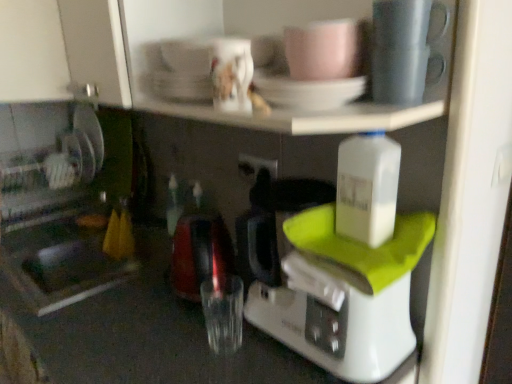
Question: Considering the positions of black plastic electric outlet at center and white plastic coffee maker at center in the image, is black plastic electric outlet at center taller or shorter than white plastic coffee maker at center?

Choices:
 (A) tall
 (B) short

Answer: (B)

Question: Is black plastic electric outlet at center in front of or behind white plastic coffee maker at center in the image?

Choices:
 (A) front
 (B) behind

Answer: (B)

Question: Estimate the real-world distances between objects in this image. Which object is farther from the black plastic electric outlet at center?

Choices:
 (A) matte gray mug at upper right, the second tableware positioned from the left
 (B) white plastic coffee maker at center
 (C) porcelain white coffee cup at upper center, the first coffee cup in the left-to-right sequence
 (D) matte ceramic mug at upper center, positioned as the second tableware in right-to-left order
 (E) pink matte mug at upper center, placed as the first coffee cup when sorted from right to left

Answer: (A)

Question: Which of these objects is positioned farthest from the matte ceramic mug at upper center, positioned as the second tableware in right-to-left order?

Choices:
 (A) matte gray mug at upper right, the second tableware positioned from the left
 (B) porcelain white coffee cup at upper center, the first coffee cup in the left-to-right sequence
 (C) pink matte mug at upper center, placed as the first coffee cup when sorted from right to left
 (D) black plastic electric outlet at center
 (E) white plastic coffee maker at center

Answer: (D)